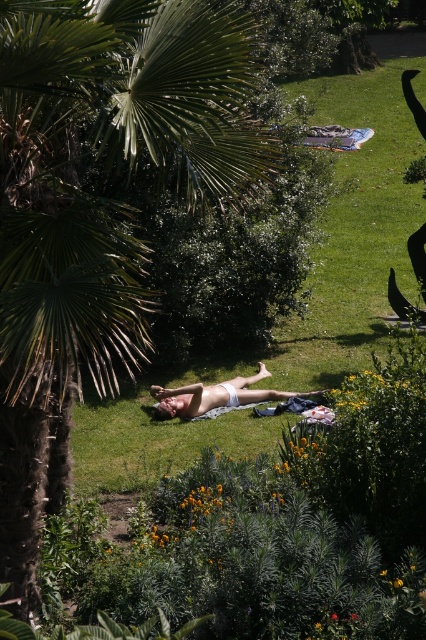
You are standing at the point marked by the coordinates (97, 208) in the image. Looking around, you notice a green leafy palm tree at left. Which direction should you face to see the green leafy palm tree at left?

You should face to the left to see the green leafy palm tree at left since the point (97, 208) represents its location.

You are a gardener who wants to place a new flower pot in the garden. The flower pot needs to be placed on a surface that is taller than the white fabric body at center. Can you use the green grass at center for this purpose?

The green grass at center has a greater height compared to the white fabric body at center, so yes, the flower pot can be placed on the green grass at center since it meets the height requirement.

You are planning to place a small picnic basket on the green grass at center. Considering the space occupied by the white fabric body at center, will there be enough room for the basket without overlapping?

The green grass at center might be wider than the white fabric body at center, so there is likely enough space to place the picnic basket without overlapping.